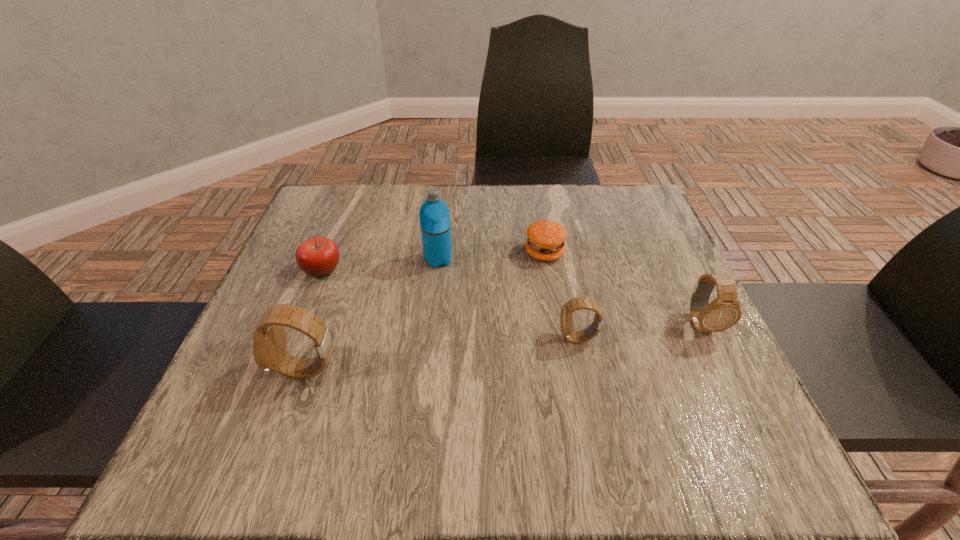
Locate an element on the screen. Image resolution: width=960 pixels, height=540 pixels. vacant space situated 0.280m on the face of the shortest watch is located at coordinates (414, 338).

Identify the location of free location located 0.100m on the face of the shortest watch. The height and width of the screenshot is (540, 960). coord(508,338).

I want to click on vacant space located on the face of the shortest watch, so click(398, 338).

The width and height of the screenshot is (960, 540). What are the coordinates of `free space located on the face of the fourth shortest object` in the screenshot? It's located at (746, 418).

You are a GUI agent. You are given a task and a screenshot of the screen. Output one action in this format:
    pyautogui.click(x=<x>, y=<y>)
    Task: Click on the vacant space situated 0.360m on the front of the shortest object
    This screenshot has width=960, height=540.
    Given the screenshot: What is the action you would take?
    tap(570, 407)

This screenshot has height=540, width=960. What are the coordinates of `free space located 0.260m on the front of the fifth tallest object` in the screenshot? It's located at (276, 387).

Identify the location of free point located 0.140m on the left of the fourth object from right to left. This screenshot has height=540, width=960. (363, 259).

Where is `object located in the near edge section of the desktop`? The image size is (960, 540). object located in the near edge section of the desktop is located at coordinates pyautogui.click(x=269, y=341).

At what (x,y) coordinates should I click in order to perform the action: click on watch positioned at the left edge. Please return your answer as a coordinate pair (x, y). This screenshot has height=540, width=960. Looking at the image, I should click on (269, 341).

The height and width of the screenshot is (540, 960). Identify the location of apple that is at the left edge. (318, 256).